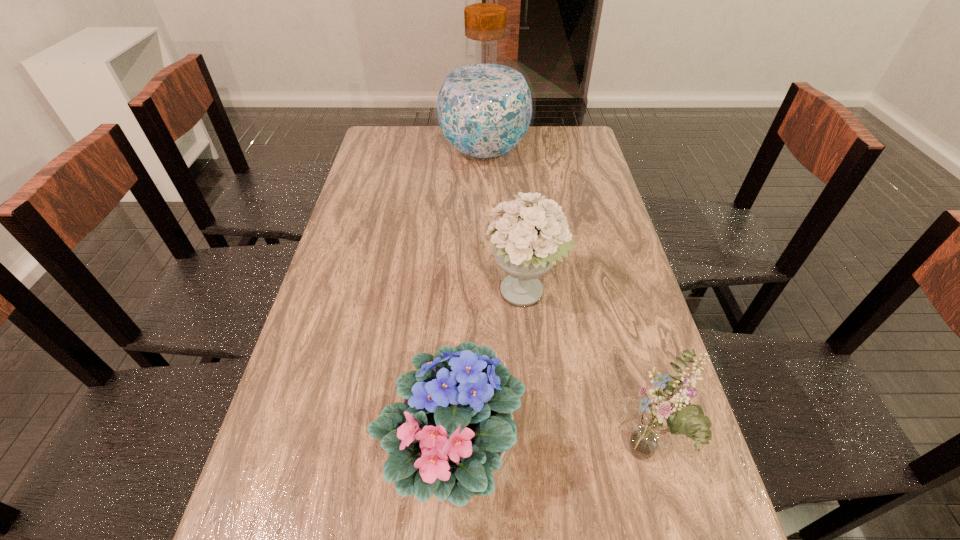
I want to click on free space between the rightmost bouquet and the tallest object, so click(564, 303).

At what (x,y) coordinates should I click in order to perform the action: click on vacant area that lies between the farthest object and the rightmost bouquet. Please return your answer as a coordinate pair (x, y). This screenshot has width=960, height=540. Looking at the image, I should click on (564, 303).

Find the location of a particular element. object that is the nearest to the farthest object is located at coordinates (528, 239).

Where is `object that can be found as the third closest to the tallest object`? The height and width of the screenshot is (540, 960). object that can be found as the third closest to the tallest object is located at coordinates (650, 431).

Locate an element on the screen. This screenshot has width=960, height=540. the second closest bouquet to the farthest object is located at coordinates (452, 434).

Identify which bouquet is the second closest to the second farthest object. Please provide its 2D coordinates. Your answer should be formatted as a tuple, i.e. [(x, y)], where the tuple contains the x and y coordinates of a point satisfying the conditions above.

[(650, 431)]